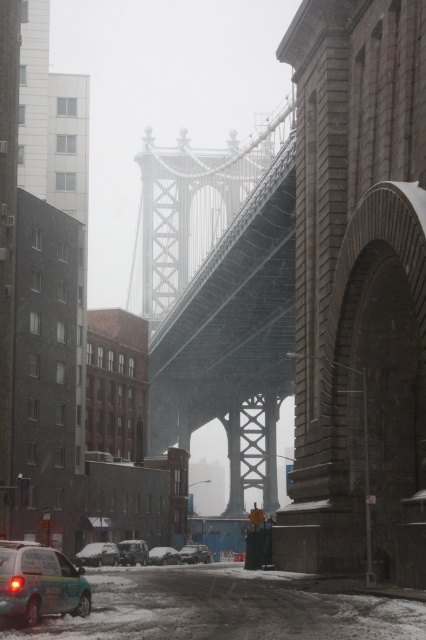
Between snow-covered cars at center and white matte van at lower left, which one has more height?

Standing taller between the two is snow-covered cars at center.

Is point (97, 563) less distant than point (92, 560)?

That is False.

Does point (155, 554) come farther from viewer compared to point (77, 556)?

Yes, point (155, 554) is behind point (77, 556).

Locate an element on the screen. The width and height of the screenshot is (426, 640). snow-covered cars at center is located at coordinates click(x=141, y=554).

Locate an element on the screen. The width and height of the screenshot is (426, 640). metallic gray bridge at center is located at coordinates (224, 307).

Is metallic gray bridge at center to the right of white matte car at center from the viewer's perspective?

Correct, you'll find metallic gray bridge at center to the right of white matte car at center.

Is point (276, 193) farther from camera compared to point (203, 547)?

No.

I want to click on metallic gray bridge at center, so click(224, 307).

Is dark gray steel suspension bridge at center smaller than snow-covered cars at center?

No, dark gray steel suspension bridge at center is not smaller than snow-covered cars at center.

Image resolution: width=426 pixels, height=640 pixels. What do you see at coordinates (325, 296) in the screenshot? I see `dark gray steel suspension bridge at center` at bounding box center [325, 296].

Is point (299, 268) farther from viewer compared to point (127, 557)?

That is False.

The image size is (426, 640). I want to click on dark gray steel suspension bridge at center, so click(x=325, y=296).